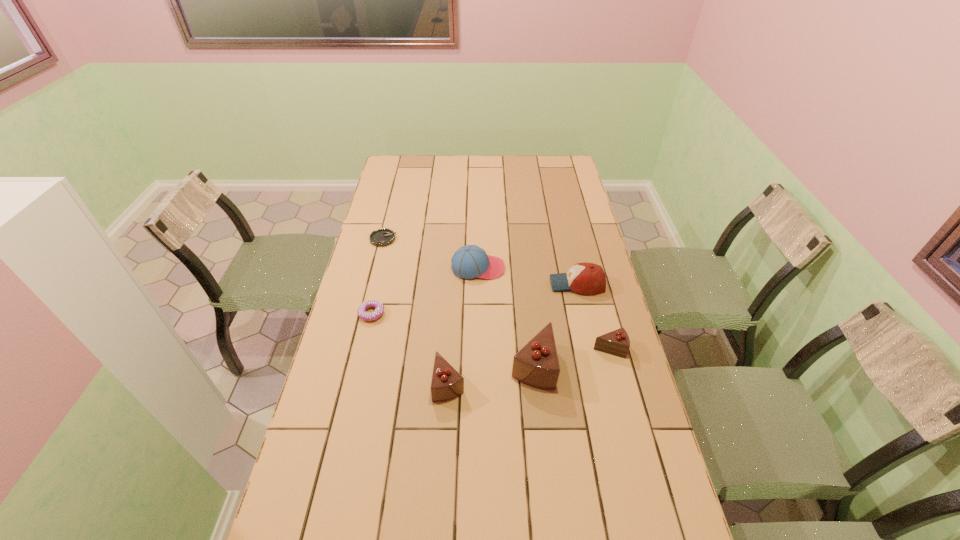
The width and height of the screenshot is (960, 540). I want to click on chocolate cake that stands as the second closest to the farthest object, so click(x=536, y=364).

You are a GUI agent. You are given a task and a screenshot of the screen. Output one action in this format:
    pyautogui.click(x=<x>, y=<y>)
    Task: Click on the chocolate cake that stands as the closest to the doughnut
    
    Given the screenshot: What is the action you would take?
    pyautogui.click(x=447, y=383)

Image resolution: width=960 pixels, height=540 pixels. Identify the location of free space that satisfies the following two spatial constraints: 1. on the front-facing side of the third shortest object; 2. on the right side of the right baseball cap. (591, 348).

Find the location of `vacant space that satisfies the following two spatial constraints: 1. on the back side of the fifth object from left to right; 2. on the front-facing side of the left baseball cap`. vacant space that satisfies the following two spatial constraints: 1. on the back side of the fifth object from left to right; 2. on the front-facing side of the left baseball cap is located at coordinates (522, 268).

The width and height of the screenshot is (960, 540). Identify the location of vacant region that satisfies the following two spatial constraints: 1. on the back side of the third shortest object; 2. on the front-facing side of the left baseball cap. (588, 268).